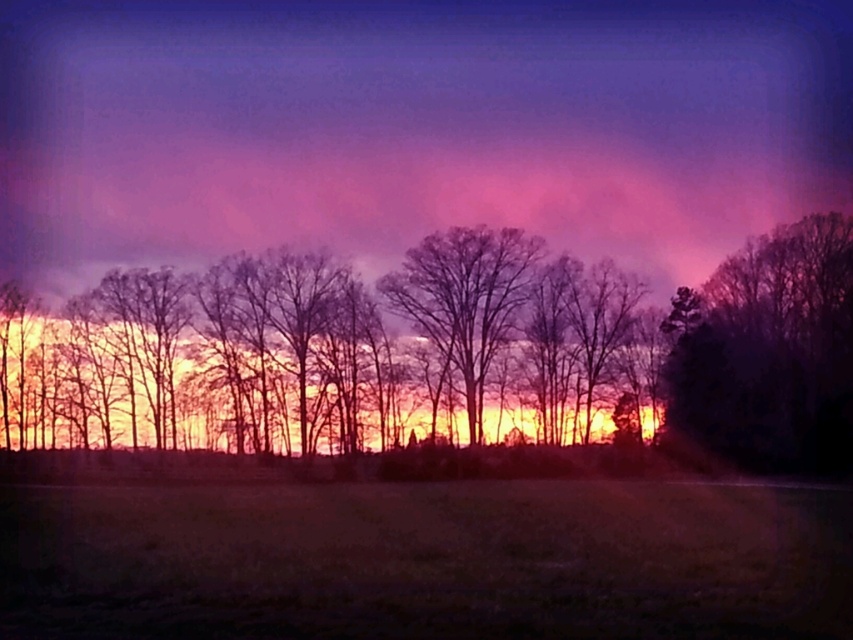
Question: Is purple cotton candy cloud at upper center positioned behind bare branches at center?

Choices:
 (A) no
 (B) yes

Answer: (B)

Question: Does purple cotton candy cloud at upper center have a greater width compared to silhouette tree at center?

Choices:
 (A) yes
 (B) no

Answer: (A)

Question: Which point is closer to the camera taking this photo?

Choices:
 (A) (497, 252)
 (B) (827, 268)
 (C) (358, 19)

Answer: (B)

Question: Which point appears farthest from the camera in this image?

Choices:
 (A) (268, 243)
 (B) (701, 388)
 (C) (213, 328)
 (D) (476, 381)

Answer: (A)

Question: Which point is farther to the camera?

Choices:
 (A) silhouette tree at center
 (B) bare branches at center

Answer: (B)

Question: Is purple cotton candy cloud at upper center positioned at the back of silhouette tree at center?

Choices:
 (A) no
 (B) yes

Answer: (B)